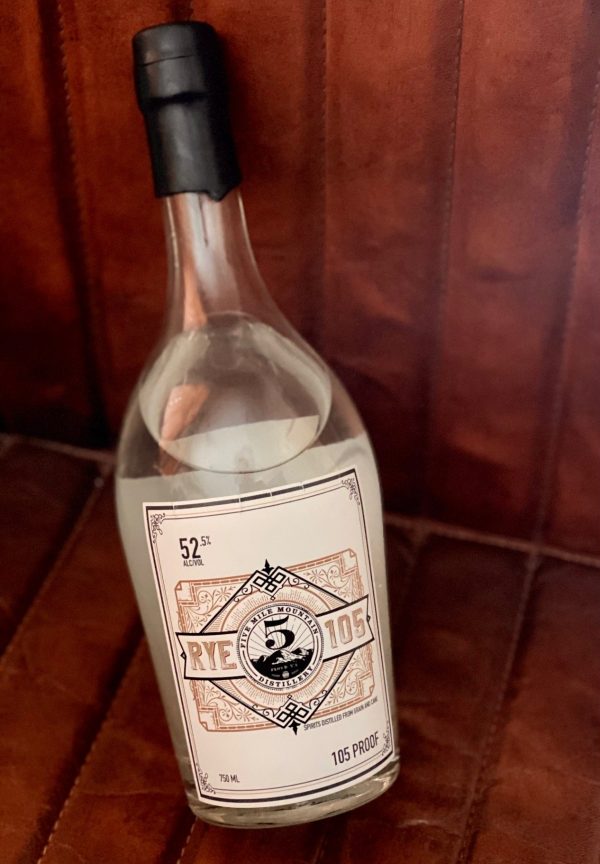
Identify the location of glass. (239, 415).